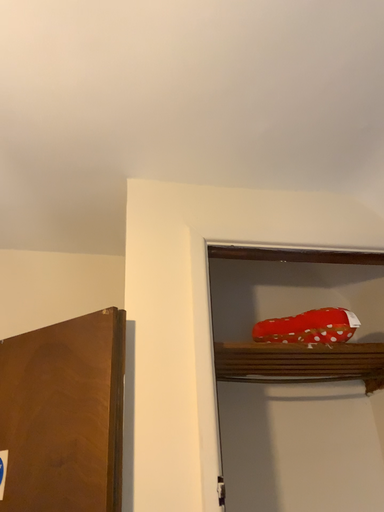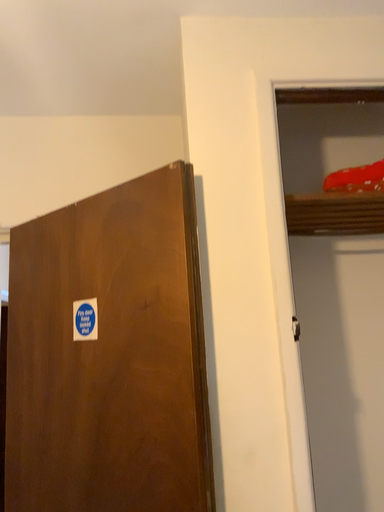
Question: How did the camera likely rotate when shooting the video?

Choices:
 (A) rotated right
 (B) rotated left

Answer: (B)